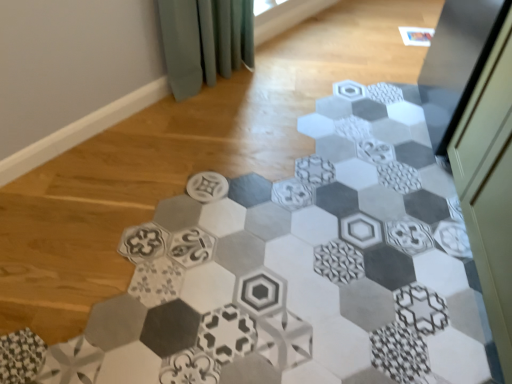
You are a GUI agent. You are given a task and a screenshot of the screen. Output one action in this format:
    pyautogui.click(x=<x>, y=<y>)
    Task: Click on the free area behind white glossy picture frame at upper right
    The height and width of the screenshot is (384, 512).
    Given the screenshot: What is the action you would take?
    pyautogui.click(x=410, y=21)